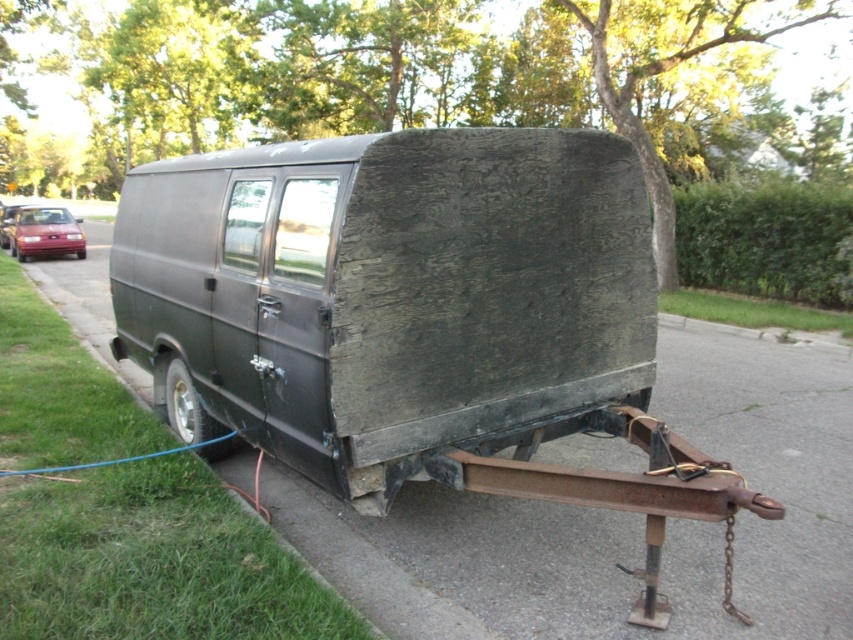
You are a pedestrian standing on the sidewalk. You see a matte black van at center and a shiny red car at left. Which vehicle is blocking the other from moving forward?

The matte black van at center is positioned under shiny red car at left, meaning the shiny red car at left is blocking the matte black van at center from moving forward.